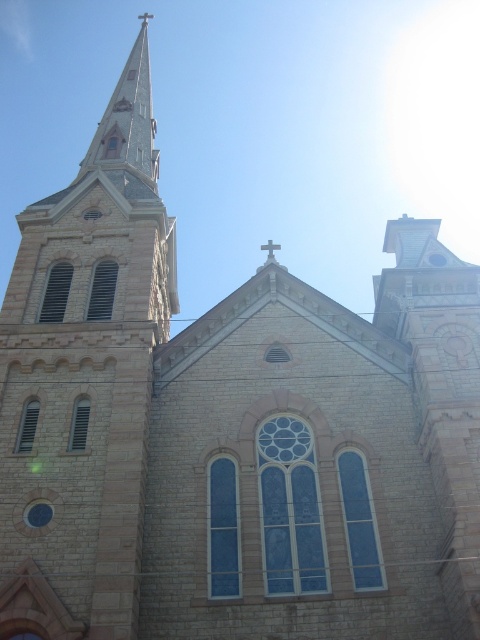
You are standing at the base of the church and want to place a new decorative flagpole between the light gray stone steeple at upper left and the metallic cross at center. The flagpole requires a minimum of 50 feet of space between its base and the nearest object. Is there enough space between the two objects to safely install the flagpole?

The light gray stone steeple at upper left is 62.61 feet from the metallic cross at center. Since the required minimum space is 50 feet, there is sufficient space to install the flagpole between them.

You are a drone operator who needs to fly a drone between the metallic cross at center and the metallic cross at upper center. The drone has a maximum flight range of 150 meters. Can the drone safely reach the other cross without running out of battery?

The metallic cross at center and metallic cross at upper center are 157.33 meters apart from each other. Since the drone can only fly up to 150 meters, it cannot safely reach the other cross without running out of battery.